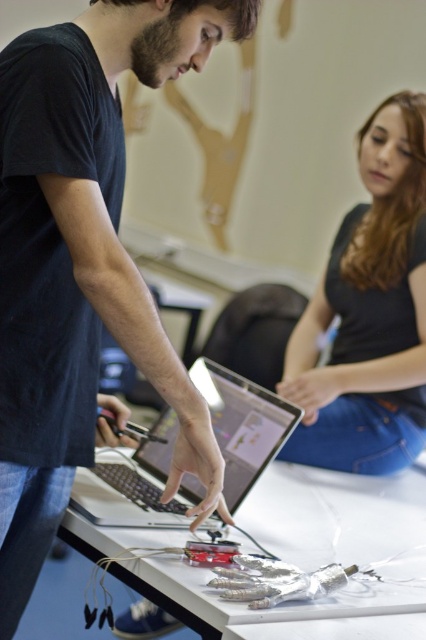
Question: Estimate the real-world distances between objects in this image. Which object is farther from the matte black laptop at center?

Choices:
 (A) white plastic table at center
 (B) black matte shirt at upper right

Answer: (B)

Question: Among these objects, which one is farthest from the camera?

Choices:
 (A) black matte shirt at upper right
 (B) silver metallic laptop at center

Answer: (A)

Question: Does black matte shirt at upper right have a smaller size compared to silver metallic laptop at center?

Choices:
 (A) no
 (B) yes

Answer: (A)

Question: Does black matte shirt at upper right have a lesser width compared to silver metallic laptop at center?

Choices:
 (A) yes
 (B) no

Answer: (A)

Question: Which object is the farthest from the silver metallic laptop at center?

Choices:
 (A) black matte shirt at upper right
 (B) white plastic table at center

Answer: (A)

Question: Does matte black laptop at center have a greater width compared to silver metallic laptop at center?

Choices:
 (A) no
 (B) yes

Answer: (A)